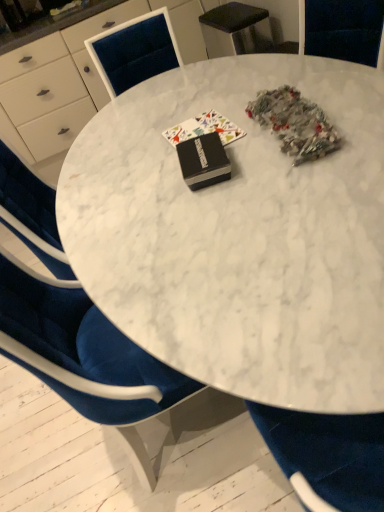
This screenshot has width=384, height=512. What are the coordinates of `free space in front of black matte book at center, which ranks as the second book in back-to-front order` in the screenshot? It's located at (222, 200).